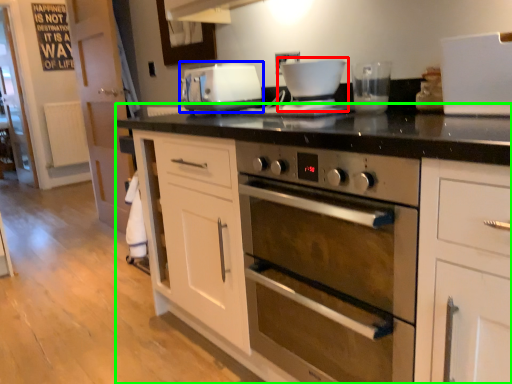
Question: Which is farther away from coffee machine (highlighted by a red box)? home appliance (highlighted by a blue box) or cabinetry (highlighted by a green box)?

Choices:
 (A) home appliance
 (B) cabinetry

Answer: (B)